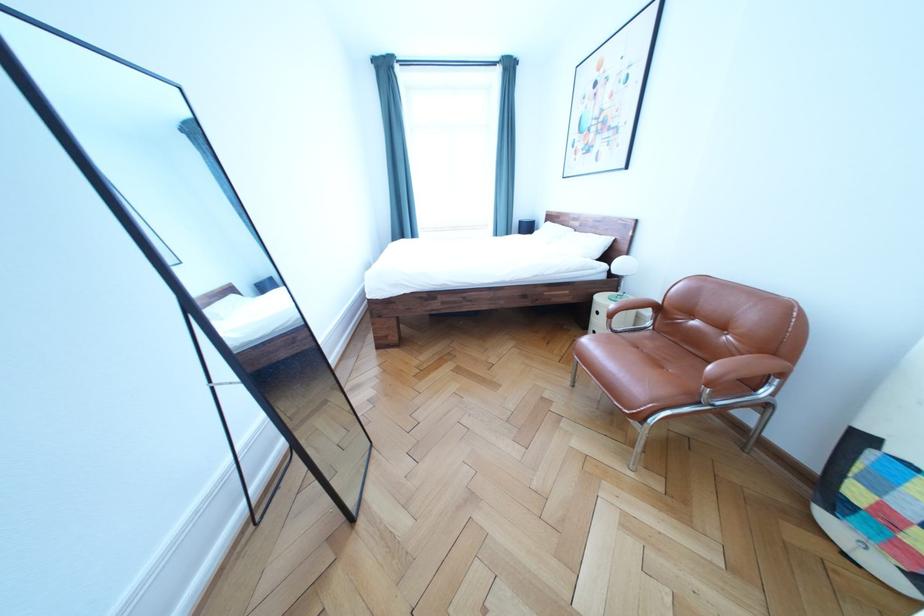
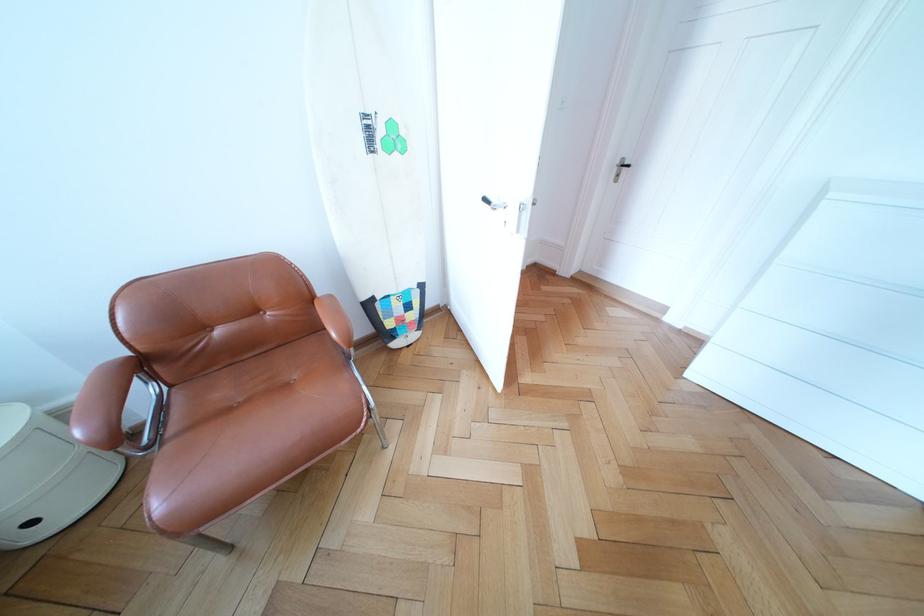
Find the pixel in the second image that matches the point at 604,339 in the first image.

(43, 529)